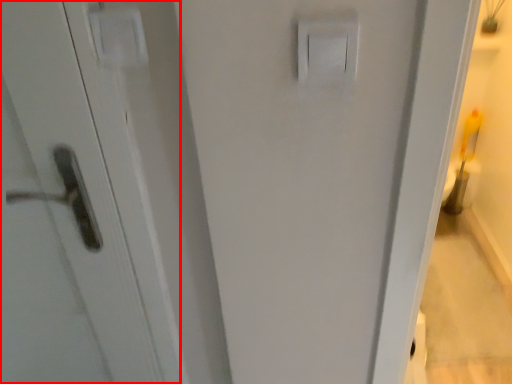
Question: Considering the relative positions of screen door (annotated by the red box) and light switch in the image provided, where is screen door (annotated by the red box) located with respect to the staircase?

Choices:
 (A) left
 (B) right

Answer: (A)